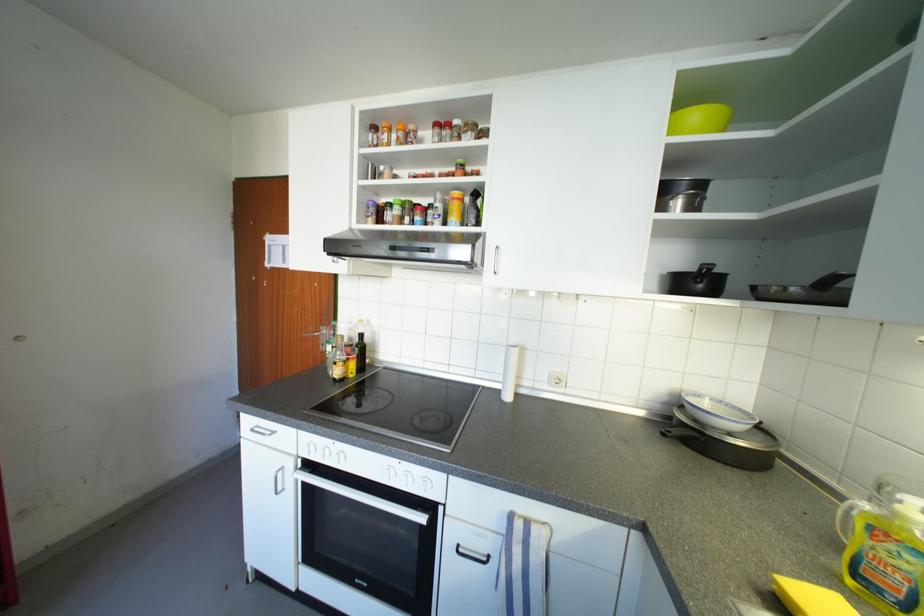
Find where to pull the white cabinet handle. Please return your answer as a coordinate pair (x, y).

(277, 480)